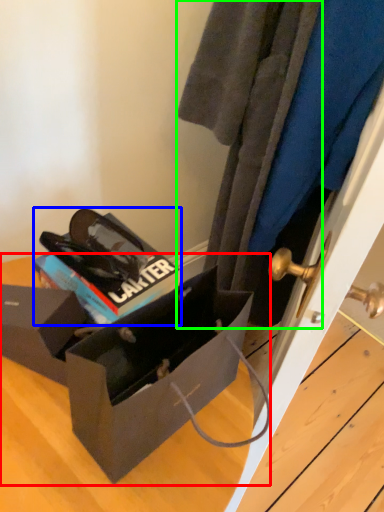
Question: Based on their relative distances, which object is nearer to box (highlighted by a red box)? Choose from kit (highlighted by a blue box) and clothing (highlighted by a green box).

Choices:
 (A) kit
 (B) clothing

Answer: (A)